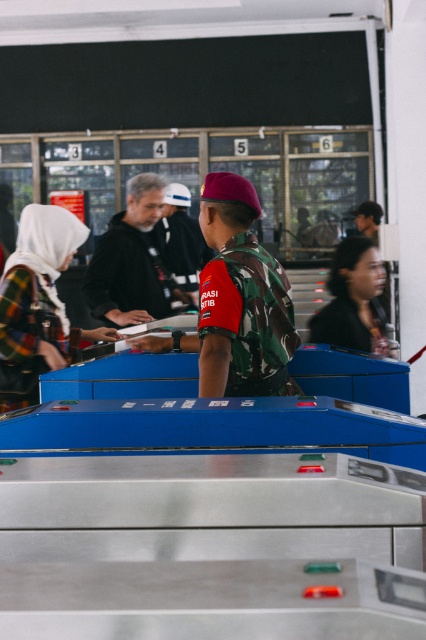
Between plaid fabric hijab at left and dark brown hair at center, which one is positioned lower?

plaid fabric hijab at left is lower down.

Who is positioned more to the left, plaid fabric hijab at left or dark brown hair at center?

plaid fabric hijab at left

What do you see at coordinates (40, 289) in the screenshot?
I see `plaid fabric hijab at left` at bounding box center [40, 289].

You are a GUI agent. You are given a task and a screenshot of the screen. Output one action in this format:
    pyautogui.click(x=<x>, y=<y>)
    Task: Click on the plaid fabric hijab at left
    
    Given the screenshot: What is the action you would take?
    pyautogui.click(x=40, y=289)

Between point (108, 273) and point (178, 225), which one is positioned behind?

Point (178, 225)

Which of these two, dark gray hoodie at center or camouflage uniform at center, stands shorter?

dark gray hoodie at center is shorter.

Is point (126, 296) more distant than point (184, 260)?

No, (126, 296) is in front of (184, 260).

Where is `dark gray hoodie at center`? The width and height of the screenshot is (426, 640). dark gray hoodie at center is located at coordinates (132, 260).

Consider the image. Can you confirm if plaid fabric hijab at left is positioned below camouflage uniform at center?

Yes.

Which of these two, plaid fabric hijab at left or camouflage uniform at center, stands shorter?

With less height is plaid fabric hijab at left.

This screenshot has height=640, width=426. What do you see at coordinates (40, 289) in the screenshot?
I see `plaid fabric hijab at left` at bounding box center [40, 289].

The image size is (426, 640). What are the coordinates of `plaid fabric hijab at left` in the screenshot? It's located at (40, 289).